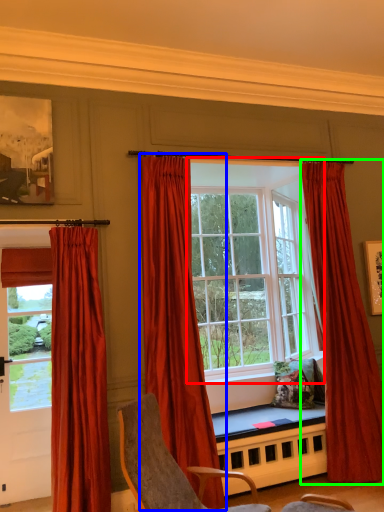
Question: Which is farther away from window (highlighted by a red box)? curtain (highlighted by a blue box) or curtain (highlighted by a green box)?

Choices:
 (A) curtain
 (B) curtain

Answer: (A)